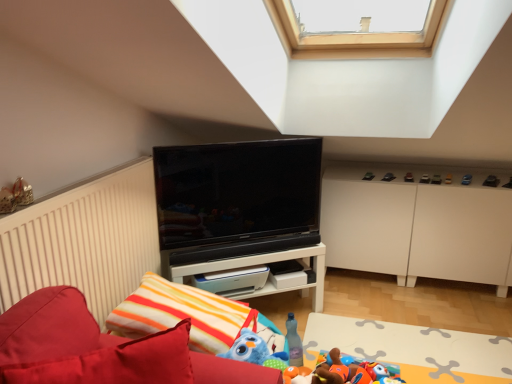
Where is `vacant point to the right of metallic silver toy car at right, the 4th toy in the top-to-bottom sequence`? vacant point to the right of metallic silver toy car at right, the 4th toy in the top-to-bottom sequence is located at coordinates (474, 176).